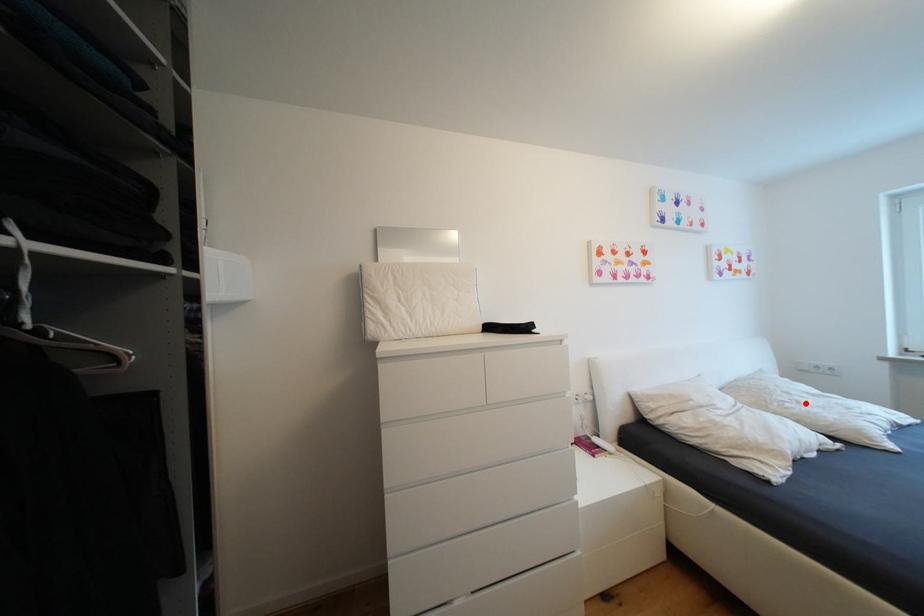
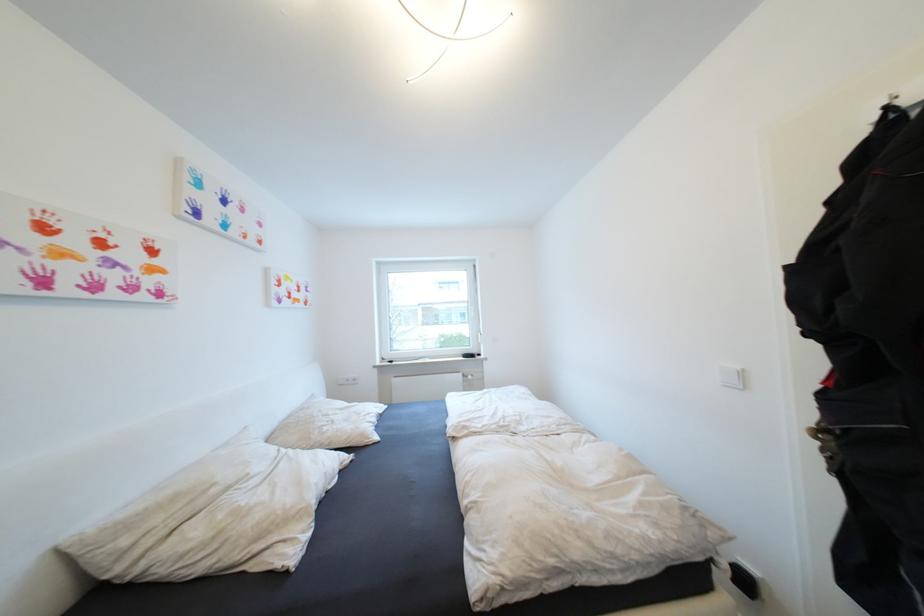
Find the pixel in the second image that matches the highlighted location in the first image.

(339, 423)